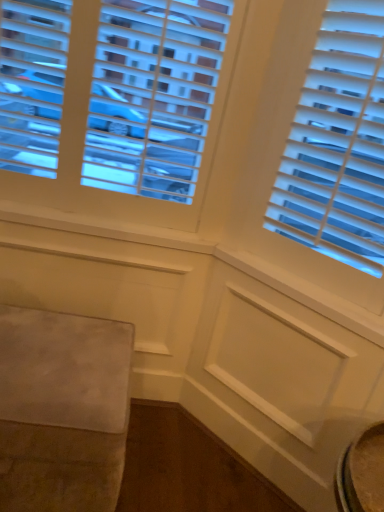
This screenshot has width=384, height=512. What are the coordinates of `vacant space situated above suede-like beige ottoman at lower left (from a real-world perspective)` in the screenshot? It's located at (59, 357).